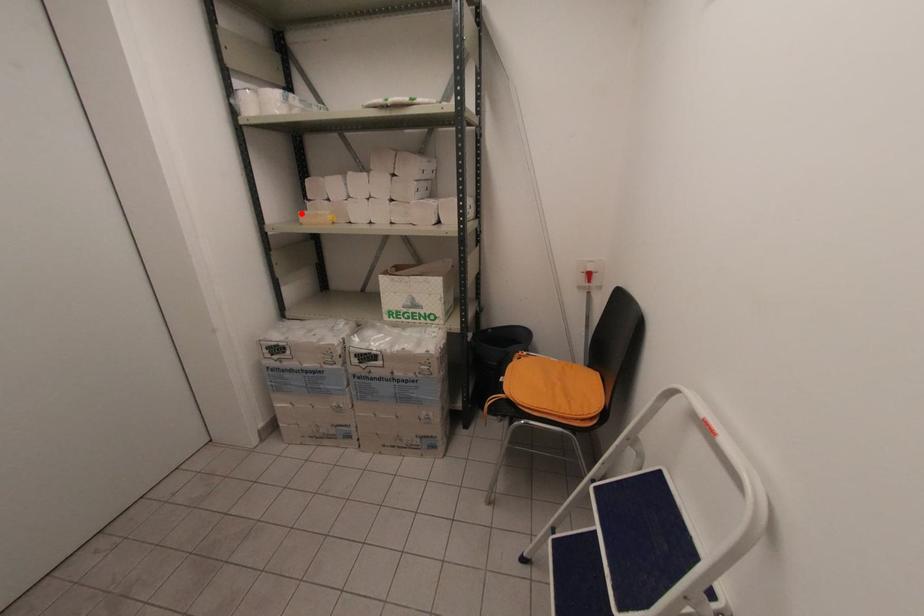
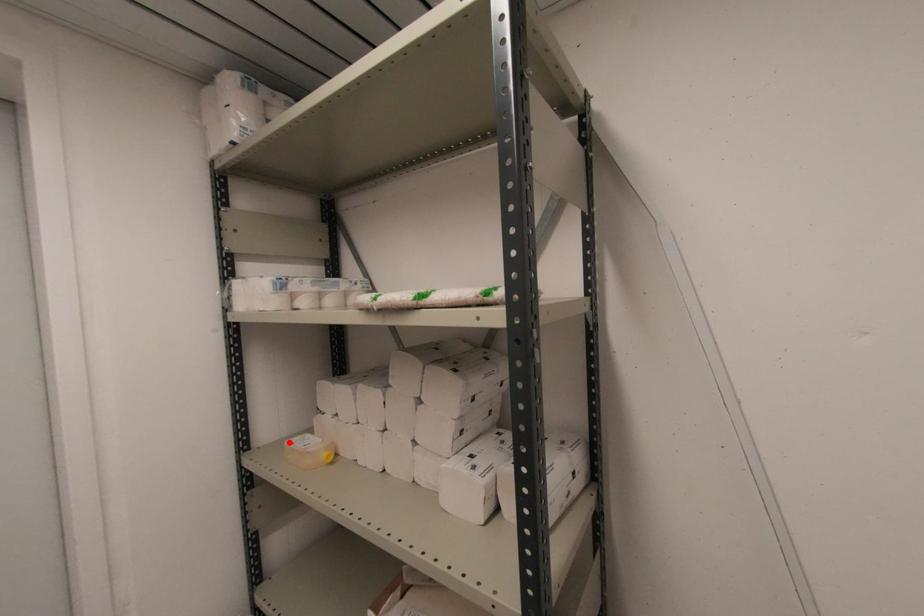
I am providing you with two images of the same scene from different viewpoints. A red point is marked on the first image and another point is marked on the second image. Does the point marked in image1 correspond to the same location as the one in image2?

Yes